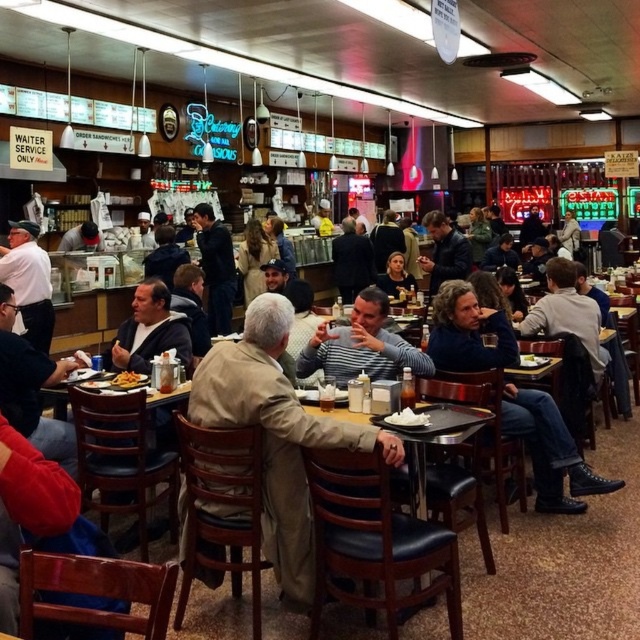
This screenshot has width=640, height=640. What are the coordinates of `striped long-sleeve shirt at center` in the screenshot? It's located at (362, 346).

Describe the element at coordinates (362, 346) in the screenshot. I see `striped long-sleeve shirt at center` at that location.

I want to click on striped long-sleeve shirt at center, so click(362, 346).

Which of these two, black plastic tray at center or white matte plate at center, stands shorter?

white matte plate at center

Does point (486, 547) lie behind point (397, 417)?

Yes, it is.

Identify the location of black plastic tray at center. (449, 436).

Does khaki cotton jacket at center have a greater height compared to yellow plastic tray at center?

Correct, khaki cotton jacket at center is much taller as yellow plastic tray at center.

Who is positioned more to the right, khaki cotton jacket at center or yellow plastic tray at center?

Positioned to the right is yellow plastic tray at center.

Where is `khaki cotton jacket at center`? khaki cotton jacket at center is located at coordinates (253, 259).